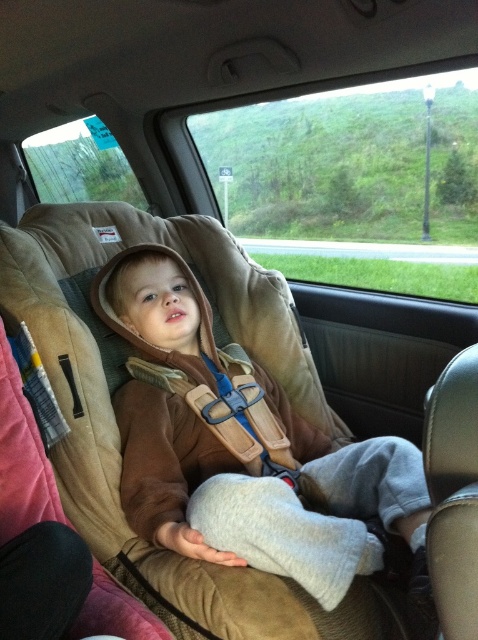
Is brown suede hoodie at center wider than suede-like beige car seat at left?

Indeed, brown suede hoodie at center has a greater width compared to suede-like beige car seat at left.

Which of these two, brown suede hoodie at center or suede-like beige car seat at left, stands taller?

Standing taller between the two is brown suede hoodie at center.

Where is `brown suede hoodie at center`? This screenshot has width=478, height=640. brown suede hoodie at center is located at coordinates (241, 445).